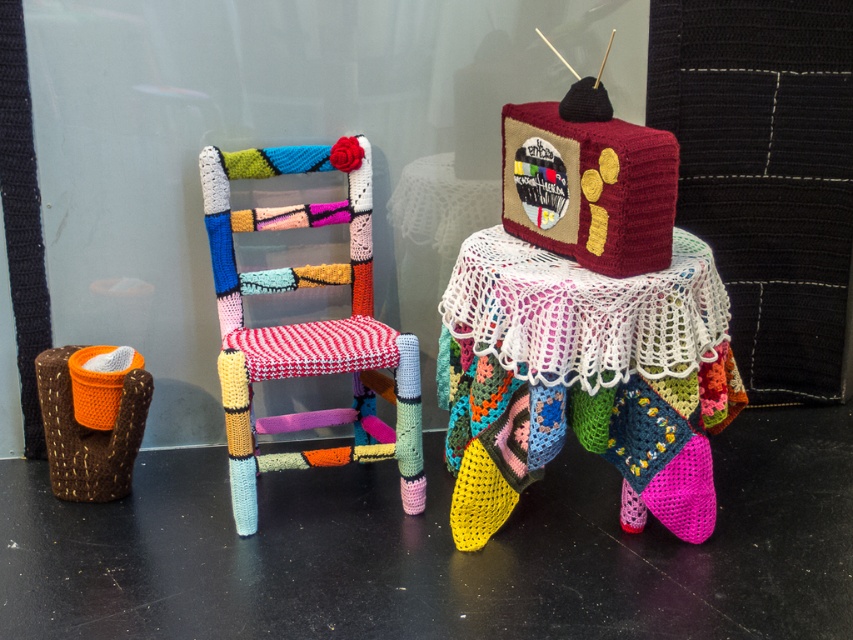
Is crochet fabric table at center taller than crochet multicolored chair at center?

No, crochet fabric table at center is not taller than crochet multicolored chair at center.

Who is lower down, crochet fabric table at center or crochet multicolored chair at center?

crochet fabric table at center

Does point (730, 380) come in front of point (250, 349)?

No.

Image resolution: width=853 pixels, height=640 pixels. Identify the location of crochet fabric table at center. (585, 378).

From the picture: Is crochet multicolored chair at center bigger than maroon knitted tv at center?

Correct, crochet multicolored chair at center is larger in size than maroon knitted tv at center.

Where is `crochet multicolored chair at center`? crochet multicolored chair at center is located at coordinates (306, 324).

Does crochet fabric table at center appear on the right side of maroon knitted tv at center?

Correct, you'll find crochet fabric table at center to the right of maroon knitted tv at center.

This screenshot has width=853, height=640. What do you see at coordinates (585, 378) in the screenshot? I see `crochet fabric table at center` at bounding box center [585, 378].

Between point (712, 508) and point (532, 124), which one is positioned in front?

Point (532, 124) is in front.

Find the location of a particular element. Image resolution: width=853 pixels, height=640 pixels. crochet fabric table at center is located at coordinates (585, 378).